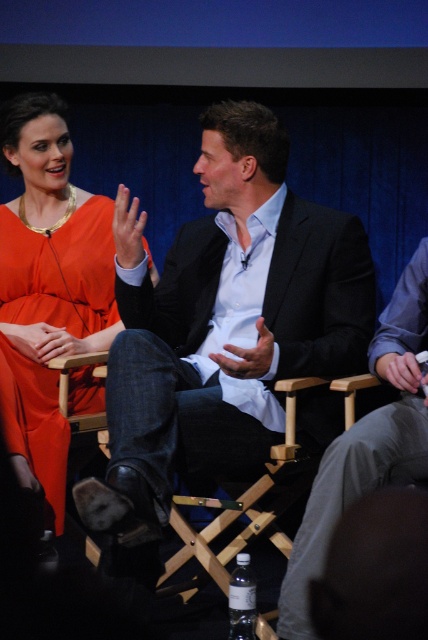
Looking at this image, is matte black suit at center to the left of matte orange dress at upper left from the viewer's perspective?

In fact, matte black suit at center is to the right of matte orange dress at upper left.

Is point (256, 412) less distant than point (53, 236)?

Yes.

I want to click on matte black suit at center, so click(x=222, y=326).

Measure the distance between matte orange dress at upper left and camera.

The distance of matte orange dress at upper left from camera is 7.69 feet.

Between matte orange dress at upper left and dark gray suit at center, which one appears on the left side from the viewer's perspective?

From the viewer's perspective, matte orange dress at upper left appears more on the left side.

Who is more distant from viewer, (83, 209) or (394, 404)?

Positioned behind is point (83, 209).

Locate an element on the screen. matte orange dress at upper left is located at coordinates (47, 289).

Does matte black suit at center have a smaller size compared to dark gray suit at center?

Actually, matte black suit at center might be larger than dark gray suit at center.

Locate an element on the screen. matte black suit at center is located at coordinates (222, 326).